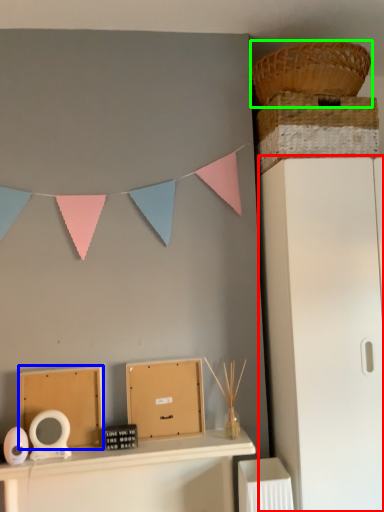
Question: Which object is positioned closest to file cabinet (highlighted by a red box)? Select from cardboard box (highlighted by a blue box) and basket (highlighted by a green box).

Choices:
 (A) cardboard box
 (B) basket

Answer: (B)